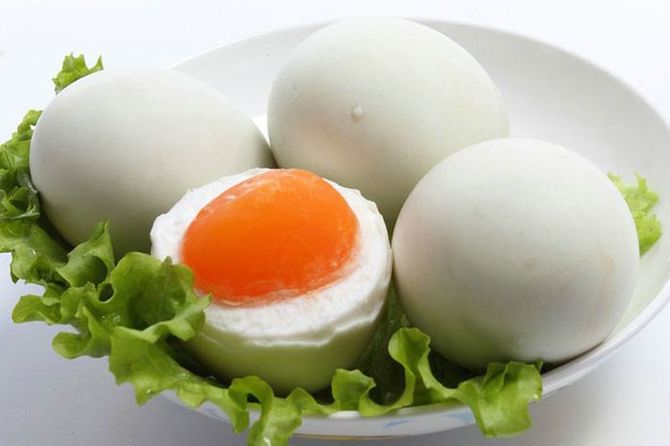
Locate an element on the screen. table is located at coordinates (68, 372).